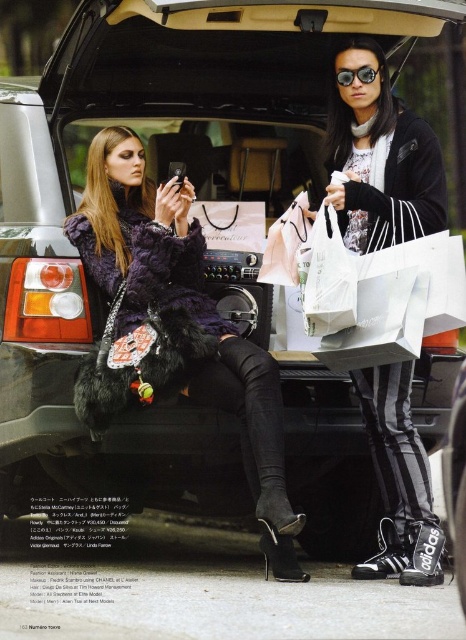
Question: In this image, where is fuzzy black coat at center located relative to black adidas sneakers at lower right?

Choices:
 (A) above
 (B) below

Answer: (B)

Question: Which is nearer to the matte black goggles at upper center?

Choices:
 (A) black adidas sneakers at lower right
 (B) fuzzy black coat at center

Answer: (A)

Question: Does black adidas sneakers at lower right have a greater width compared to matte black goggles at upper center?

Choices:
 (A) yes
 (B) no

Answer: (A)

Question: Which of the following is the farthest from the observer?

Choices:
 (A) (178, 262)
 (B) (438, 212)
 (C) (341, 68)

Answer: (A)

Question: Does fuzzy black coat at center appear under black adidas sneakers at lower right?

Choices:
 (A) no
 (B) yes

Answer: (B)

Question: Which of the following is the closest to the observer?

Choices:
 (A) fuzzy black coat at center
 (B) matte black goggles at upper center
 (C) black adidas sneakers at lower right

Answer: (A)